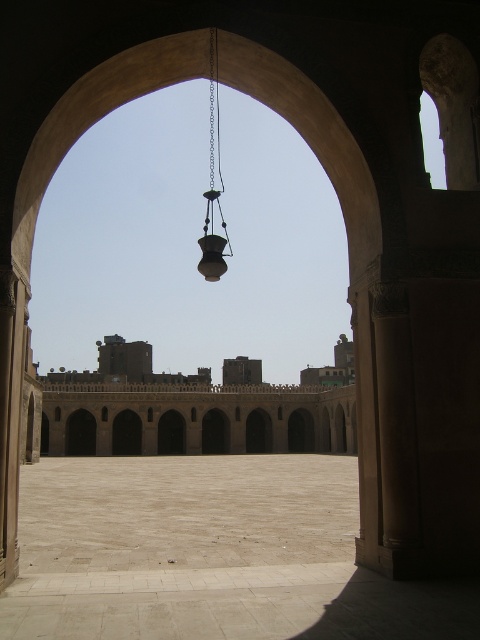
In the scene shown: Which of these two, beige stone palace at center or metallic chain at center, stands shorter?

beige stone palace at center is shorter.

You are a GUI agent. You are given a task and a screenshot of the screen. Output one action in this format:
    pyautogui.click(x=<x>, y=<y>)
    Task: Click on the beige stone palace at center
    Image resolution: width=480 pixels, height=640 pixels.
    Given the screenshot: What is the action you would take?
    pyautogui.click(x=200, y=412)